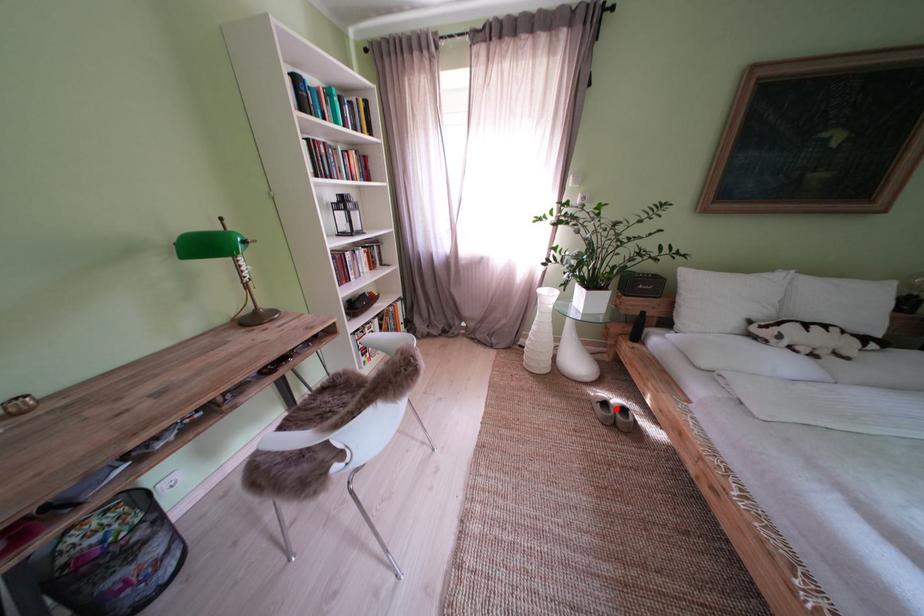
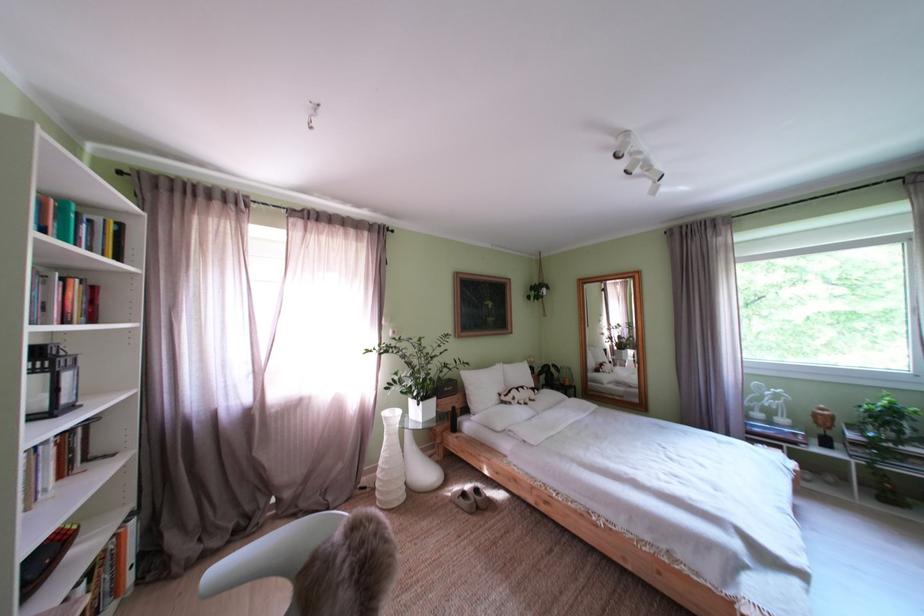
Question: I am providing you with two images of the same scene from different viewpoints. A red point is shown in image1. For the corresponding object point in image2, is it positioned nearer or farther from the camera?

Choices:
 (A) Nearer
 (B) Farther

Answer: (B)